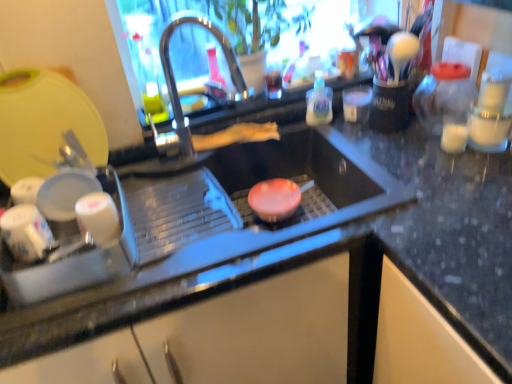
Question: From the image's perspective, is white glossy cups at left, which is the second appliance in top-to-bottom order, located above or below translucent plastic bottle at upper right?

Choices:
 (A) below
 (B) above

Answer: (A)

Question: From a real-world perspective, is white glossy cups at left, which is the second appliance in top-to-bottom order, positioned above or below translucent plastic bottle at upper right?

Choices:
 (A) below
 (B) above

Answer: (A)

Question: Estimate the real-world distances between objects in this image. Which object is farther from the yellow plastic cutting board at upper left, the 2th appliance from the bottom?

Choices:
 (A) translucent plastic bottle at upper right
 (B) white glossy cups at left, the 1th appliance in the bottom-to-top sequence
 (C) polished stainless steel tap at center

Answer: (A)

Question: Which object is positioned closest to the yellow plastic cutting board at upper left, which is the 1th appliance in top-to-bottom order?

Choices:
 (A) white glossy cups at left, which is the second appliance in top-to-bottom order
 (B) translucent plastic bottle at upper right
 (C) polished stainless steel tap at center

Answer: (A)